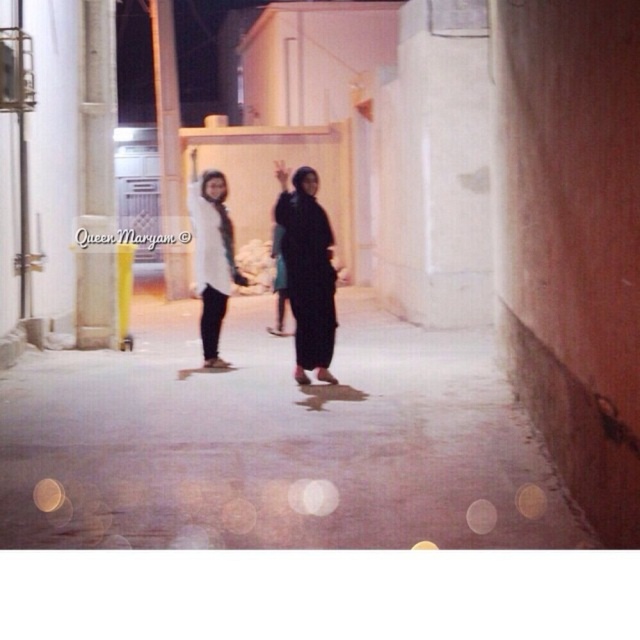
Question: Which object is the closest to the smooth concrete pavement at center?

Choices:
 (A) matte black dress at center
 (B) black matte hijab at center
 (C) white matte shirt at center

Answer: (B)

Question: Is smooth concrete pavement at center bigger than black matte hijab at center?

Choices:
 (A) no
 (B) yes

Answer: (B)

Question: Is matte black dress at center to the left of white matte shirt at center from the viewer's perspective?

Choices:
 (A) yes
 (B) no

Answer: (B)

Question: Is matte black dress at center to the right of white matte shirt at center from the viewer's perspective?

Choices:
 (A) yes
 (B) no

Answer: (A)

Question: Which point appears farthest from the camera in this image?

Choices:
 (A) (288, 289)
 (B) (388, 500)
 (C) (225, 272)
 (D) (316, 280)

Answer: (C)

Question: Among these points, which one is nearest to the camera?

Choices:
 (A) (321, 307)
 (B) (221, 296)
 (C) (305, 195)

Answer: (C)